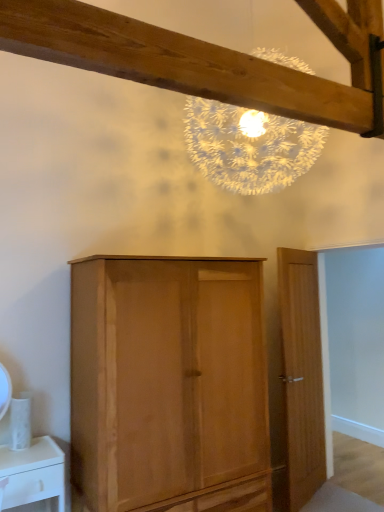
Question: Should I look upward or downward to see light brown wooden door at right?

Choices:
 (A) up
 (B) down

Answer: (B)

Question: Considering the relative sizes of light brown wooden door at right and light brown wood cupboard at center in the image provided, is light brown wooden door at right taller than light brown wood cupboard at center?

Choices:
 (A) no
 (B) yes

Answer: (B)

Question: Could light brown wood cupboard at center be considered to be inside light brown wooden door at right?

Choices:
 (A) yes
 (B) no

Answer: (B)

Question: Considering the relative sizes of light brown wooden door at right and light brown wood cupboard at center in the image provided, is light brown wooden door at right wider than light brown wood cupboard at center?

Choices:
 (A) no
 (B) yes

Answer: (A)

Question: Would you say light brown wooden door at right is a long distance from light brown wood cupboard at center?

Choices:
 (A) no
 (B) yes

Answer: (A)

Question: Is light brown wooden door at right in contact with light brown wood cupboard at center?

Choices:
 (A) yes
 (B) no

Answer: (B)

Question: Can you confirm if light brown wooden door at right is shorter than light brown wood cupboard at center?

Choices:
 (A) yes
 (B) no

Answer: (B)

Question: Does light brown wood cupboard at center have a greater height compared to light brown wooden door at right?

Choices:
 (A) yes
 (B) no

Answer: (B)

Question: Is light brown wood cupboard at center bigger than light brown wooden door at right?

Choices:
 (A) yes
 (B) no

Answer: (A)

Question: Is the surface of light brown wood cupboard at center in direct contact with light brown wooden door at right?

Choices:
 (A) no
 (B) yes

Answer: (A)

Question: From a real-world perspective, is light brown wood cupboard at center located beneath light brown wooden door at right?

Choices:
 (A) no
 (B) yes

Answer: (B)

Question: Is light brown wooden door at right at the back of light brown wood cupboard at center?

Choices:
 (A) no
 (B) yes

Answer: (A)

Question: Considering the relative sizes of light brown wood cupboard at center and light brown wooden door at right in the image provided, is light brown wood cupboard at center smaller than light brown wooden door at right?

Choices:
 (A) yes
 (B) no

Answer: (B)

Question: Looking at their shapes, would you say light brown wooden door at right is wider or thinner than light brown wood cupboard at center?

Choices:
 (A) thin
 (B) wide

Answer: (A)